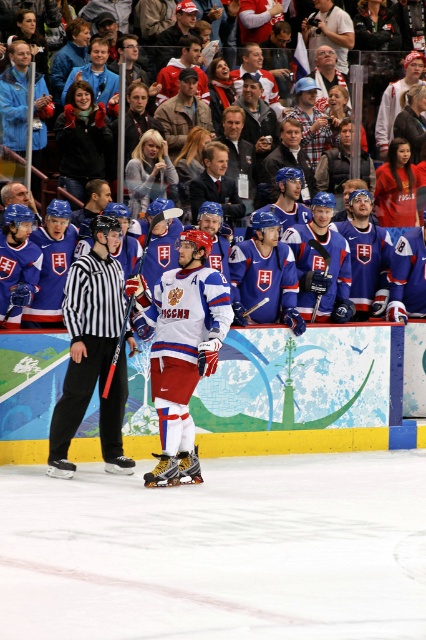
Locate an element on the screen. This screenshot has width=426, height=640. blue jersey at center is located at coordinates (305, 392).

Is blue jersey at center wider than matte blue hockey stick at center?

Yes.

Is point (195, 392) farther from viewer compared to point (324, 269)?

No, (195, 392) is in front of (324, 269).

Identify the location of blue jersey at center. (305, 392).

Is the position of black striped shirt at left less distant than that of blue jersey fans at center?

Yes, black striped shirt at left is closer to the viewer.

How much distance is there between black striped shirt at left and blue jersey fans at center?

9.59 meters

Is point (51, 448) positioned before point (374, 113)?

Yes, it is in front of point (374, 113).

The image size is (426, 640). Identify the location of black striped shirt at left. tap(92, 352).

Between point (164, 360) and point (411, 28), which one is positioned behind?

The point (411, 28) is more distant.

Can you confirm if white matte jersey at center is smaller than blue jersey fans at center?

Actually, white matte jersey at center might be larger than blue jersey fans at center.

Does point (149, 324) come behind point (411, 1)?

That is False.

At what (x,y) coordinates should I click in order to perform the action: click on white matte jersey at center. Please return your answer as a coordinate pair (x, y). The height and width of the screenshot is (640, 426). Looking at the image, I should click on pyautogui.click(x=183, y=349).